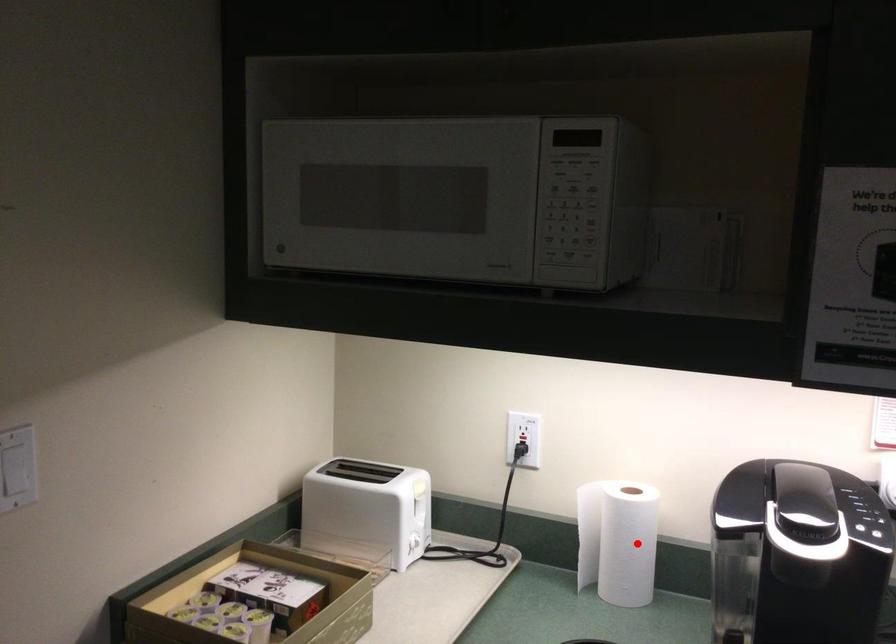
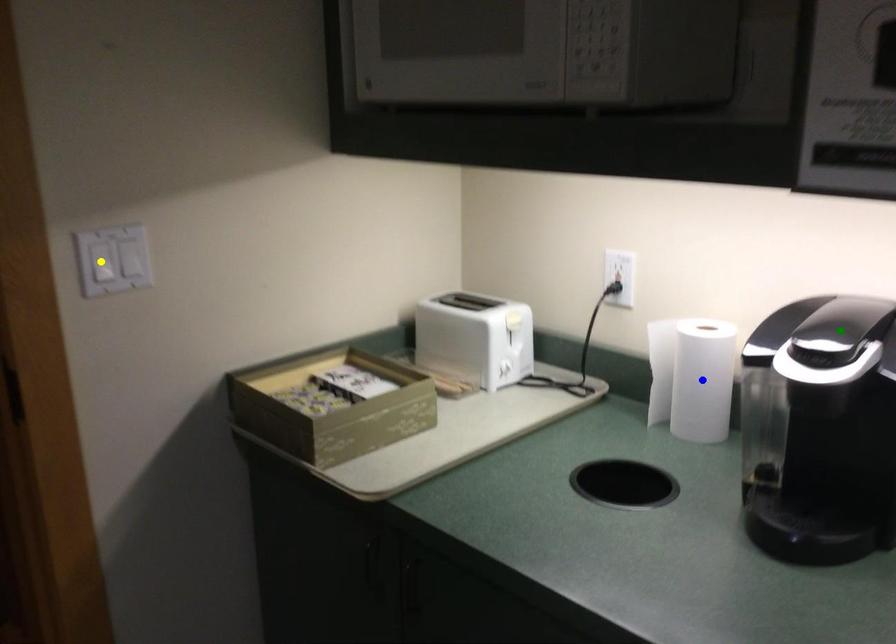
Question: I am providing you with two images of the same scene from different viewpoints. A red point is marked on the first image. You are given multiple points on the second image. Which spot in image 2 lines up with the point in image 1?

Choices:
 (A) blue point
 (B) yellow point
 (C) green point

Answer: (A)